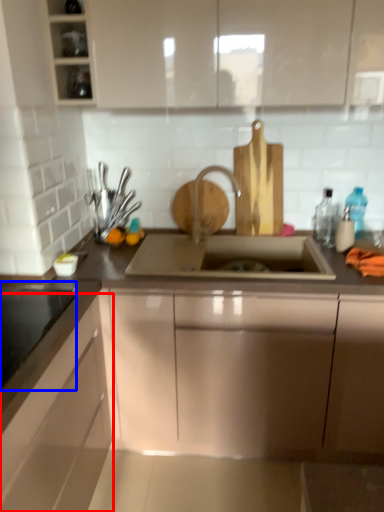
Question: Which object appears closest to the camera in this image, cabinetry (highlighted by a red box) or appliance (highlighted by a blue box)?

Choices:
 (A) cabinetry
 (B) appliance

Answer: (A)